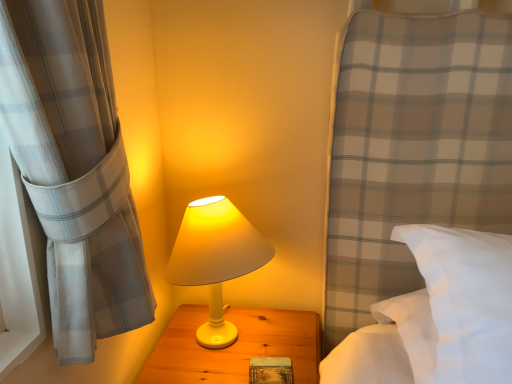
Locate an element on the screen. vacant point above white matte wood nightstand at center (from a real-world perspective) is located at coordinates (230, 347).